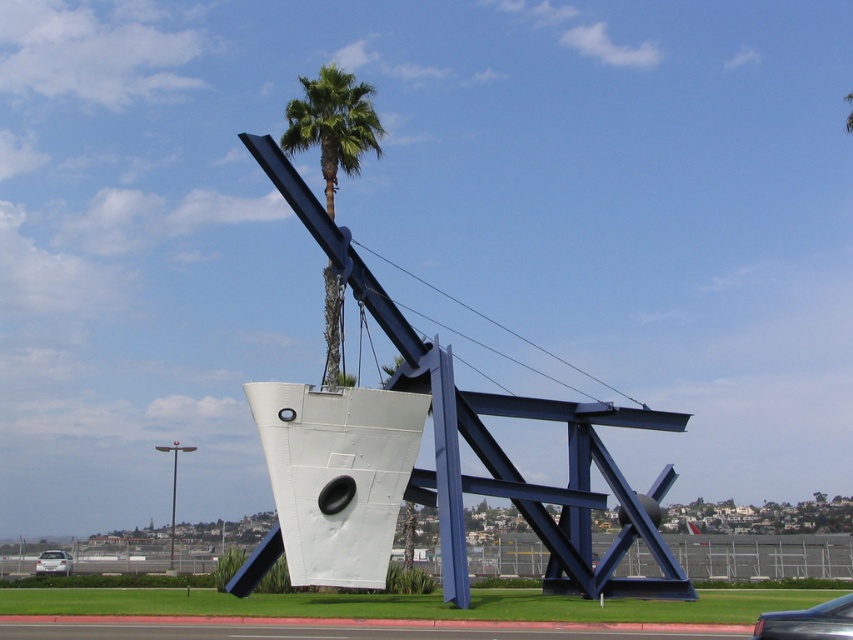
You are standing at the base of the green leafy palm tree at upper center and want to reach the metallic blue car at center. If your walking speed is 1.2 meters per second, how many seconds will it take you to walk directly to the car?

The distance between the green leafy palm tree at upper center and the metallic blue car at center is 26.40 meters. At a speed of 1.2 meters per second, it would take 26.40 divided by 1.2 equals 22 seconds to reach the car.

You are driving a metallic blue car at center and want to park it in a spot that requires backing into a space. To ensure you don not hit the green leafy palm tree at upper center, which direction should you turn your wheels before backing up?

The green leafy palm tree at upper center is positioned on the left side of metallic blue car at center, so you should turn your wheels to the right to avoid hitting the tree while backing up.